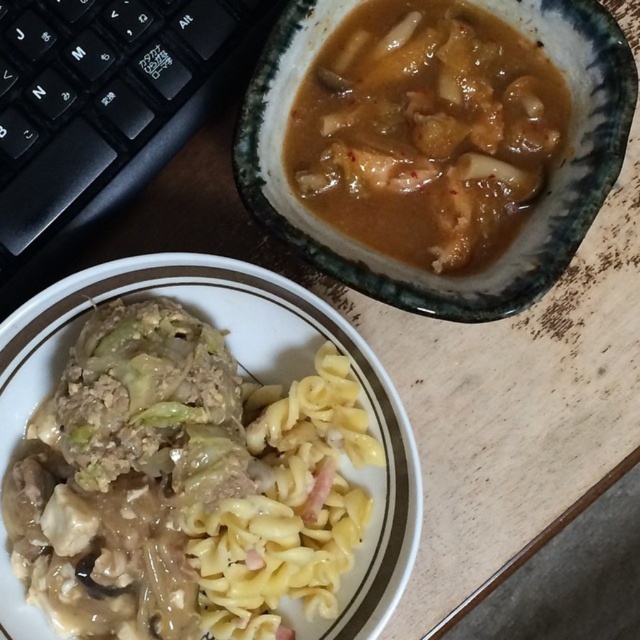
Question: Among these points, which one is farthest from the camera?

Choices:
 (A) (465, 173)
 (B) (228, 604)

Answer: (A)

Question: Is yellowish matte pasta at lower left thinner than brown matte stew at upper center?

Choices:
 (A) yes
 (B) no

Answer: (B)

Question: Observing the image, what is the correct spatial positioning of yellowish matte pasta at lower left in reference to brown matte stew at upper center?

Choices:
 (A) below
 (B) above

Answer: (A)

Question: Estimate the real-world distances between objects in this image. Which object is closer to the brown matte stew at upper center?

Choices:
 (A) yellowish matte pasta at lower left
 (B) yellow matte pasta at center

Answer: (B)

Question: Which object is the farthest from the yellowish matte pasta at lower left?

Choices:
 (A) yellow matte pasta at center
 (B) brown matte stew at upper center

Answer: (B)

Question: Is brown matte stew at upper center below yellow matte pasta at center?

Choices:
 (A) no
 (B) yes

Answer: (A)